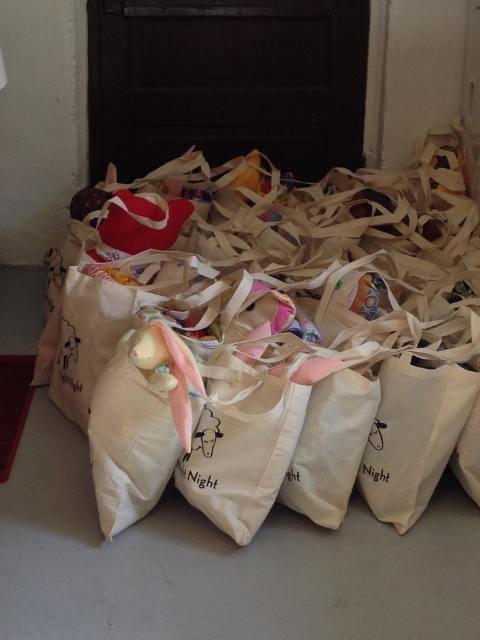
Question: Considering the relative positions of white cotton bag at center and soft pink fabric stuffed animal at center in the image provided, where is white cotton bag at center located with respect to soft pink fabric stuffed animal at center?

Choices:
 (A) right
 (B) left

Answer: (A)

Question: Which point is farther from the camera taking this photo?

Choices:
 (A) (163, 340)
 (B) (466, 486)

Answer: (B)

Question: Where is white cotton bag at center located in relation to soft pink fabric stuffed animal at center in the image?

Choices:
 (A) left
 (B) right

Answer: (B)

Question: Which point appears closest to the camera in this image?

Choices:
 (A) (240, 506)
 (B) (135, 358)

Answer: (B)

Question: Which of the following is the closest to the observer?

Choices:
 (A) white cotton bag at center
 (B) soft pink fabric stuffed animal at center

Answer: (B)

Question: Can you confirm if white cotton bag at center is thinner than soft pink fabric stuffed animal at center?

Choices:
 (A) no
 (B) yes

Answer: (A)